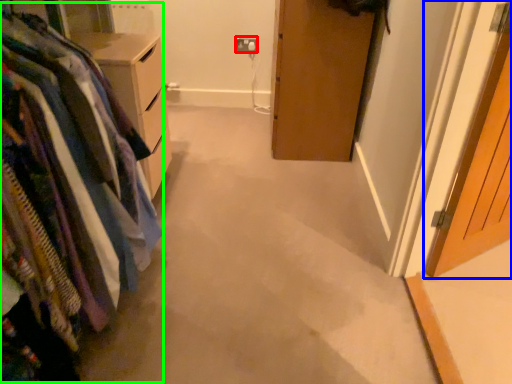
Question: Estimate the real-world distances between objects in this image. Which object is closer to electric outlet (highlighted by a red box), door (highlighted by a blue box) or closet (highlighted by a green box)?

Choices:
 (A) door
 (B) closet

Answer: (A)